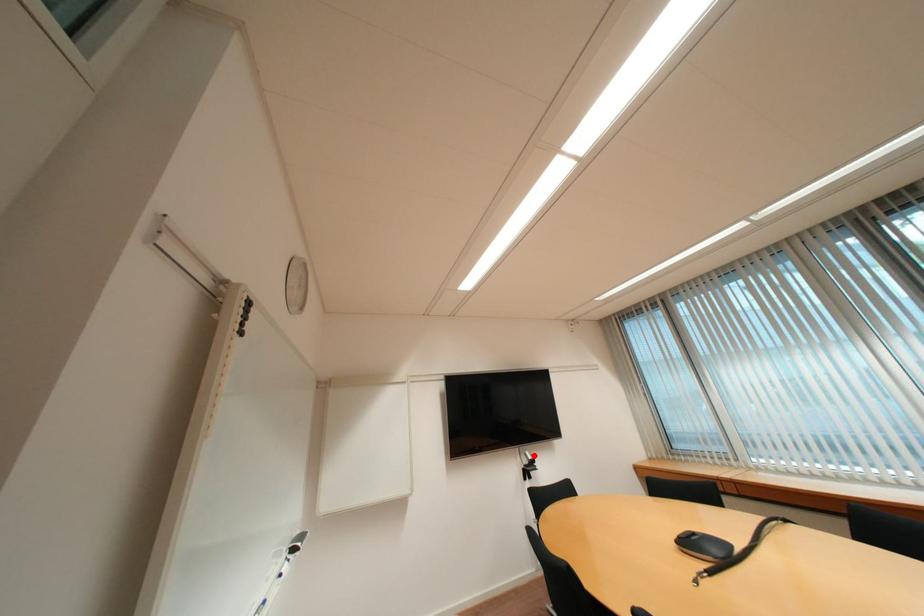
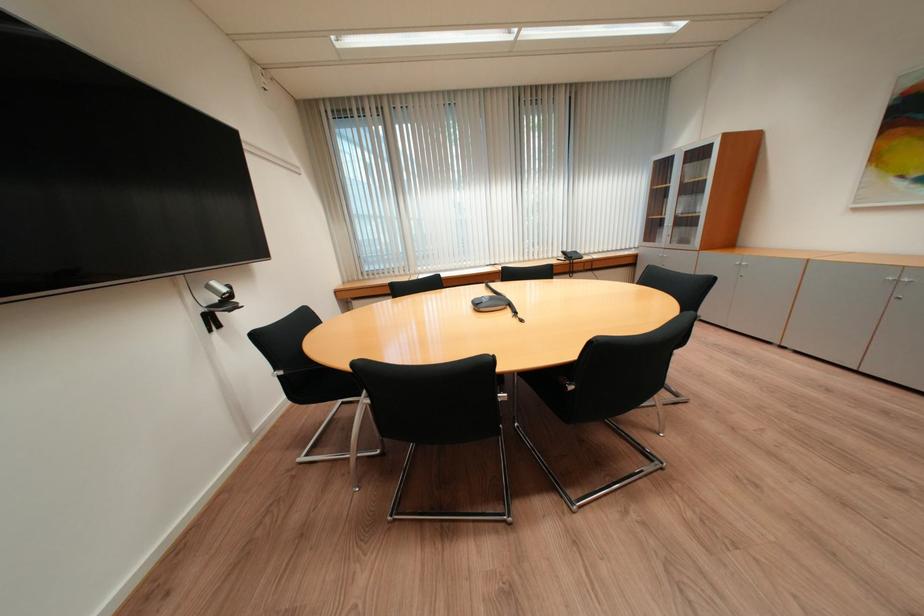
In the second image, find the point that corresponds to the highlighted location in the first image.

(217, 289)